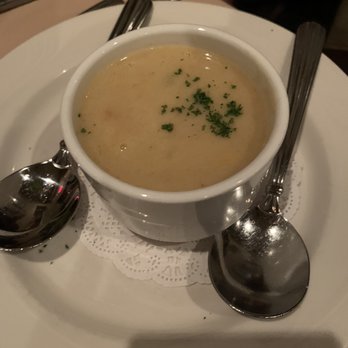
Find the location of `spoon`. spoon is located at coordinates (254, 267), (47, 194).